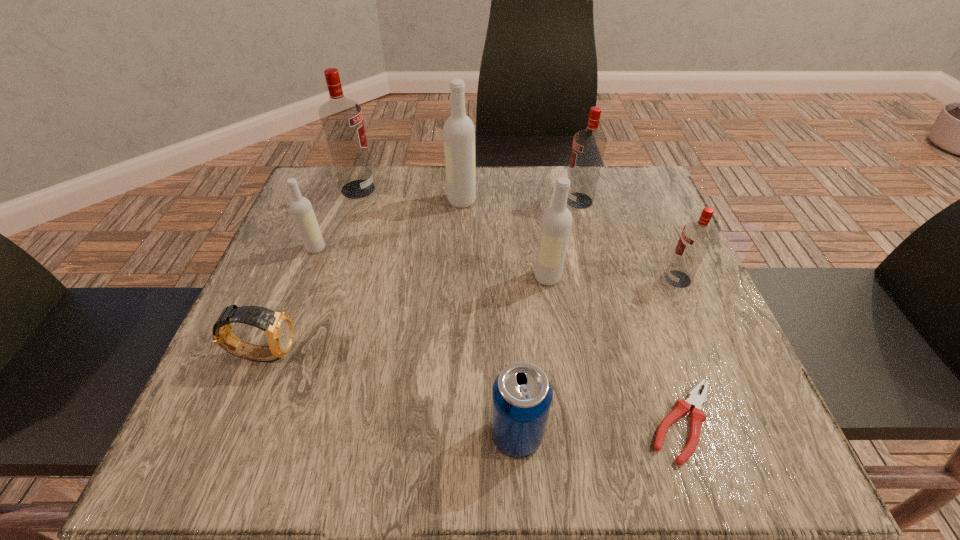
At what (x,y) coordinates should I click in order to perform the action: click on the fourth vodka from right to left. Please return your answer as a coordinate pair (x, y). The image size is (960, 540). Looking at the image, I should click on (459, 132).

This screenshot has width=960, height=540. I want to click on the farthest white vodka, so click(x=459, y=132).

Where is `the biggest red vodka`? the biggest red vodka is located at coordinates (342, 121).

The image size is (960, 540). In order to click on the second red vodka from right to left in this screenshot , I will do `click(589, 145)`.

Where is `the second vodka from right to left`? Image resolution: width=960 pixels, height=540 pixels. the second vodka from right to left is located at coordinates (589, 145).

Identify the location of the sixth object from left to right. This screenshot has width=960, height=540. click(x=556, y=223).

Where is `the second biggest white vodka`? The height and width of the screenshot is (540, 960). the second biggest white vodka is located at coordinates (556, 223).

Image resolution: width=960 pixels, height=540 pixels. In order to click on the nearest red vodka in this screenshot , I will do `click(696, 237)`.

Find the location of a particular element. This screenshot has height=540, width=960. the rightmost red vodka is located at coordinates (696, 237).

Where is `the sixth nearest object`? the sixth nearest object is located at coordinates (301, 208).